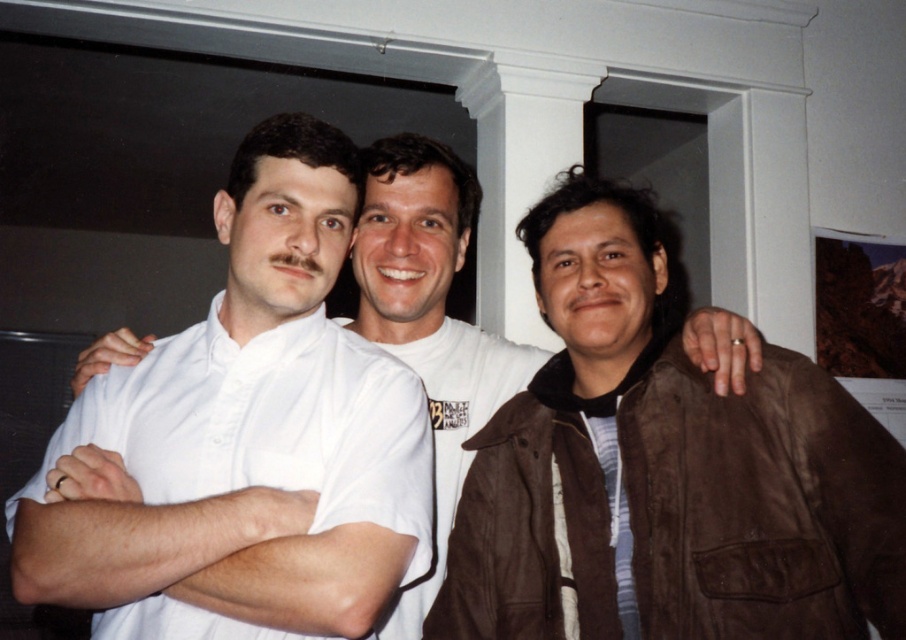
Question: Which object appears closest to the camera in this image?

Choices:
 (A) white cotton shirt at left
 (B) white shirt at center

Answer: (A)

Question: Does white shirt at center lie in front of striped cotton shirt at center?

Choices:
 (A) yes
 (B) no

Answer: (B)

Question: Is brown suede jacket at right to the left of striped cotton shirt at center from the viewer's perspective?

Choices:
 (A) yes
 (B) no

Answer: (B)

Question: Which is farther from the white shirt at center?

Choices:
 (A) white cotton shirt at left
 (B) striped cotton shirt at center
 (C) brown suede jacket at right

Answer: (B)

Question: In this image, where is white cotton shirt at left located relative to striped cotton shirt at center?

Choices:
 (A) right
 (B) left

Answer: (B)

Question: Which object appears farthest from the camera in this image?

Choices:
 (A) striped cotton shirt at center
 (B) brown suede jacket at right
 (C) white shirt at center
 (D) white cotton shirt at left

Answer: (C)